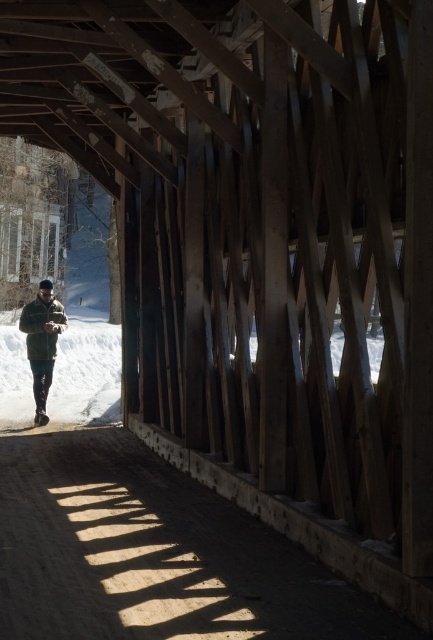
You are standing at the entrance of the wooden covered bridge and see the point marked as point (87,369). What does this point represent?

The point (87,369) represents the location of the white fluffy snow at center.

You are standing at the entrance of the wooden covered bridge and see the smooth dirt path at center. If you walk straight ahead, will you eventually reach the snowy landscape outside?

Yes, because the smooth dirt path at center leads to the open end of the bridge, which overlooks the snowy landscape outside.